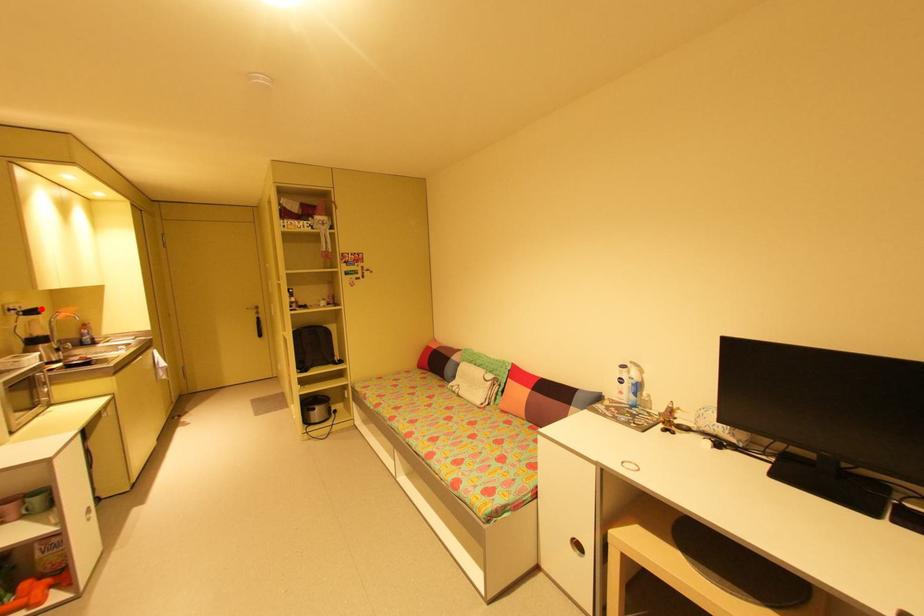
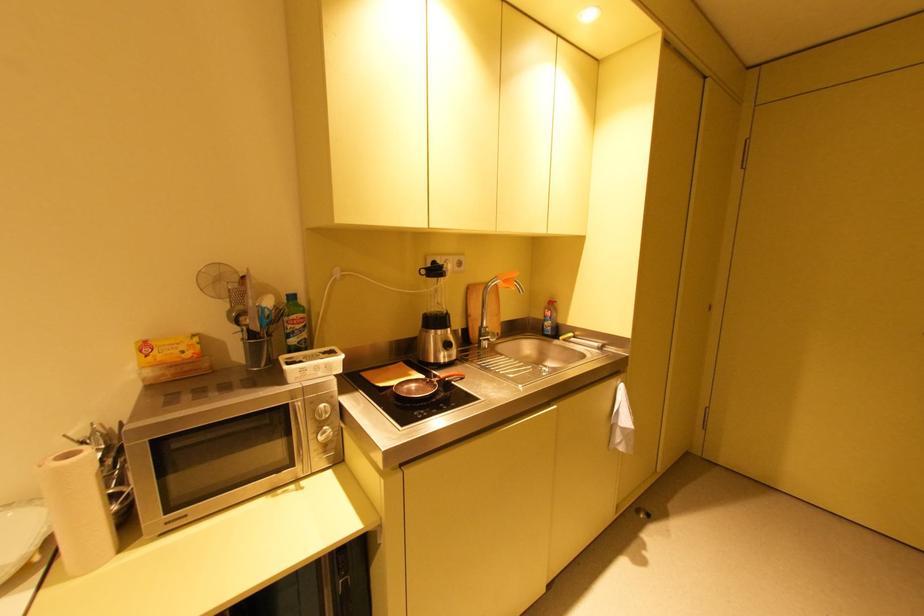
Question: I am providing you with two images of the same scene from different viewpoints. A red point is marked on the first image. Is the red point's position out of view in image 2?

Choices:
 (A) Yes
 (B) No

Answer: (B)